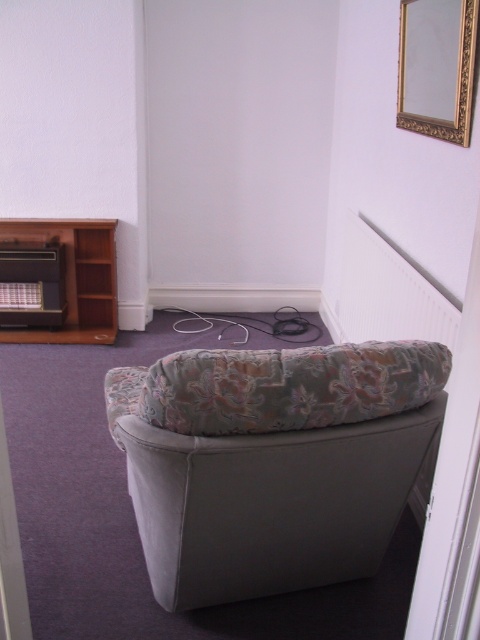
Is gold ornate picture frame at upper right behind brown wooden bookshelf at left?

No, gold ornate picture frame at upper right is closer to the viewer.

Who is lower down, gold ornate picture frame at upper right or brown wooden bookshelf at left?

brown wooden bookshelf at left is lower down.

Who is more forward, (425, 10) or (68, 330)?

Point (425, 10) is more forward.

Identify the location of gold ornate picture frame at upper right. (436, 67).

Consider the image. How much distance is there between suede-patterned armchair at center and gold ornate picture frame at upper right?

They are 1.27 meters apart.

Find the location of a particular element. suede-patterned armchair at center is located at coordinates (273, 461).

Which is in front, point (307, 380) or point (272, 410)?

Point (272, 410) is in front.

Measure the distance between suede-patterned armchair at center and floral fabric pillow at center.

suede-patterned armchair at center and floral fabric pillow at center are 6.46 inches apart.

Between point (144, 372) and point (276, 397), which one is positioned behind?

The point (144, 372) is more distant.

What are the coordinates of `suede-patterned armchair at center` in the screenshot? It's located at (273, 461).